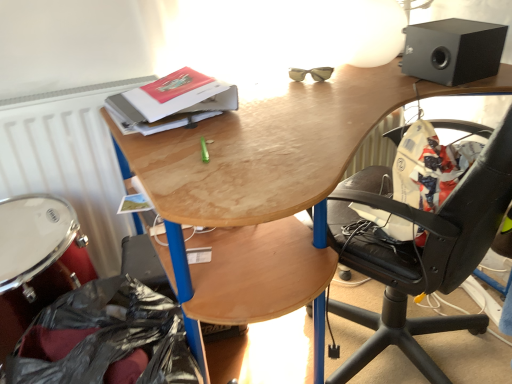
Question: Is black plastic bag at lower left looking in the opposite direction of white polished drum at lower left?

Choices:
 (A) no
 (B) yes

Answer: (B)

Question: Can you confirm if black plastic bag at lower left is thinner than white polished drum at lower left?

Choices:
 (A) no
 (B) yes

Answer: (B)

Question: From a real-world perspective, is black plastic bag at lower left beneath white polished drum at lower left?

Choices:
 (A) no
 (B) yes

Answer: (B)

Question: Considering the relative positions of black plastic bag at lower left and white polished drum at lower left in the image provided, is black plastic bag at lower left in front of white polished drum at lower left?

Choices:
 (A) yes
 (B) no

Answer: (A)

Question: Is black plastic bag at lower left not close to white polished drum at lower left?

Choices:
 (A) yes
 (B) no

Answer: (B)

Question: Is black plastic bag at lower left facing towards white polished drum at lower left?

Choices:
 (A) yes
 (B) no

Answer: (B)

Question: Does hardcover book at upper center turn towards white matte radiator at left?

Choices:
 (A) no
 (B) yes

Answer: (A)

Question: Is hardcover book at upper center outside of white matte radiator at left?

Choices:
 (A) no
 (B) yes

Answer: (B)

Question: Is hardcover book at upper center to the left of white matte radiator at left from the viewer's perspective?

Choices:
 (A) yes
 (B) no

Answer: (B)

Question: Can you confirm if hardcover book at upper center is positioned to the right of white matte radiator at left?

Choices:
 (A) no
 (B) yes

Answer: (B)

Question: Is hardcover book at upper center shorter than white matte radiator at left?

Choices:
 (A) no
 (B) yes

Answer: (B)

Question: Is hardcover book at upper center thinner than white matte radiator at left?

Choices:
 (A) no
 (B) yes

Answer: (A)

Question: Is white matte radiator at left oriented towards white polished drum at lower left?

Choices:
 (A) yes
 (B) no

Answer: (A)